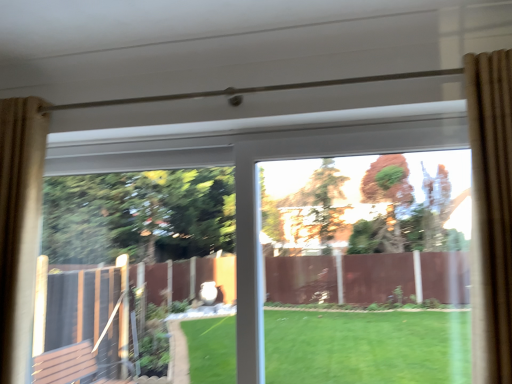
This screenshot has width=512, height=384. What do you see at coordinates (368, 228) in the screenshot? I see `transparent glass window at center` at bounding box center [368, 228].

The image size is (512, 384). In order to click on transparent glass window at center in this screenshot , I will do `click(368, 228)`.

Measure the distance between point (338, 285) and camera.

The depth of point (338, 285) is 1.68 meters.

You are a GUI agent. You are given a task and a screenshot of the screen. Output one action in this format:
    pyautogui.click(x=<x>, y=<y>)
    Task: Click on the transparent glass window at center
    The image size is (512, 384).
    Given the screenshot: What is the action you would take?
    pyautogui.click(x=368, y=228)